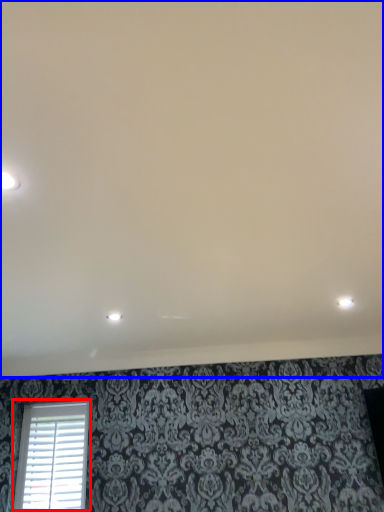
Question: Which object is closer to the camera taking this photo, window (highlighted by a red box) or backdrop (highlighted by a blue box)?

Choices:
 (A) window
 (B) backdrop

Answer: (B)